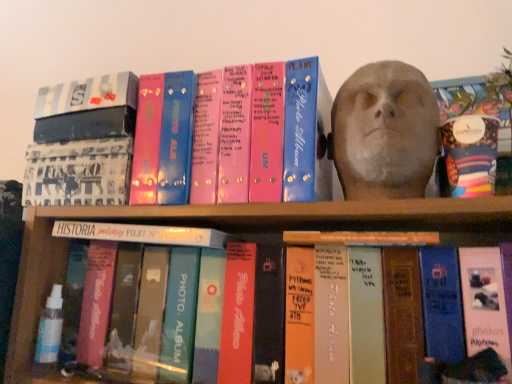
Question: From the image's perspective, is white matte book at center, the 1th book from the bottom, on top of multicolored fabric bag at upper right?

Choices:
 (A) yes
 (B) no

Answer: (B)

Question: From a real-world perspective, is white matte book at center, the 1th book from the bottom, on multicolored fabric bag at upper right?

Choices:
 (A) yes
 (B) no

Answer: (B)

Question: Is white matte book at center, the 1th book from the bottom, looking in the opposite direction of multicolored fabric bag at upper right?

Choices:
 (A) yes
 (B) no

Answer: (B)

Question: Is white matte book at center, arranged as the third book when viewed from the top, taller than multicolored fabric bag at upper right?

Choices:
 (A) no
 (B) yes

Answer: (A)

Question: Is white matte book at center, arranged as the third book when viewed from the top, not close to multicolored fabric bag at upper right?

Choices:
 (A) no
 (B) yes

Answer: (A)

Question: Considering the relative sizes of white matte book at center, the 1th book from the bottom, and multicolored fabric bag at upper right in the image provided, is white matte book at center, the 1th book from the bottom, thinner than multicolored fabric bag at upper right?

Choices:
 (A) yes
 (B) no

Answer: (B)

Question: Can you confirm if multicolored fabric bag at upper right is smaller than white matte book at center, the 1th book from the bottom?

Choices:
 (A) yes
 (B) no

Answer: (A)

Question: Does multicolored fabric bag at upper right have a greater height compared to white matte book at center, arranged as the third book when viewed from the top?

Choices:
 (A) no
 (B) yes

Answer: (B)

Question: From the image's perspective, is multicolored fabric bag at upper right on white matte book at center, arranged as the third book when viewed from the top?

Choices:
 (A) no
 (B) yes

Answer: (B)

Question: From a real-world perspective, is multicolored fabric bag at upper right on top of white matte book at center, the 1th book from the bottom?

Choices:
 (A) yes
 (B) no

Answer: (A)

Question: Is white matte book at center, the 1th book from the bottom, completely or partially inside multicolored fabric bag at upper right?

Choices:
 (A) yes
 (B) no

Answer: (B)

Question: Considering the relative sizes of multicolored fabric bag at upper right and white matte book at center, the 1th book from the bottom, in the image provided, is multicolored fabric bag at upper right shorter than white matte book at center, the 1th book from the bottom,?

Choices:
 (A) no
 (B) yes

Answer: (A)

Question: Does matte gray bust at upper right have a smaller size compared to white matte book at center, the 1th book from the bottom?

Choices:
 (A) yes
 (B) no

Answer: (B)